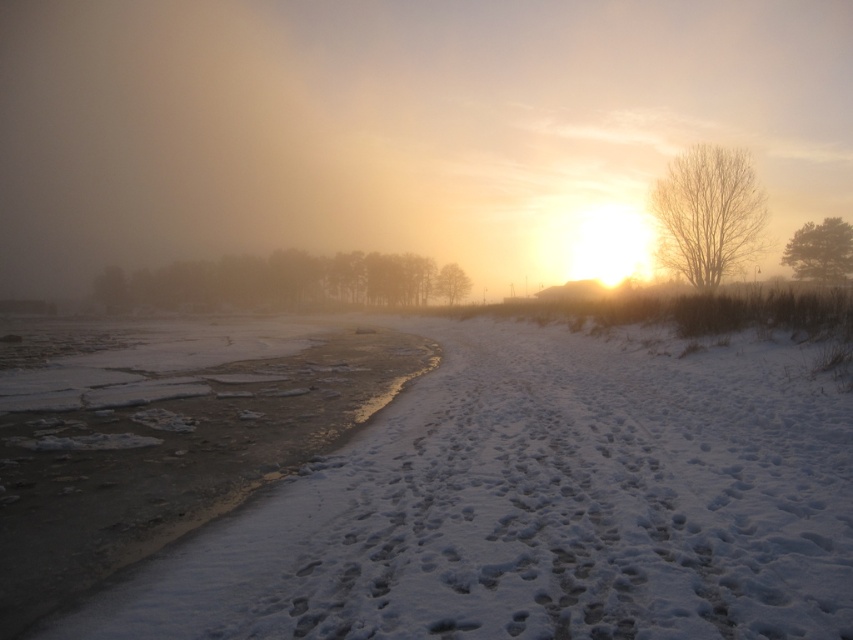
Question: Among these objects, which one is farthest from the camera?

Choices:
 (A) green textured tree at right
 (B) smooth brown tree at center

Answer: (B)

Question: Can you confirm if green matte trees at center is smaller than smooth brown tree at center?

Choices:
 (A) yes
 (B) no

Answer: (B)

Question: Which point is closer to the camera?

Choices:
 (A) (439, 294)
 (B) (785, 253)

Answer: (B)

Question: Which point appears closest to the camera in this image?

Choices:
 (A) (732, 266)
 (B) (811, 253)
 (C) (460, 280)

Answer: (A)

Question: Does bare branches at right appear over smooth brown tree at center?

Choices:
 (A) no
 (B) yes

Answer: (B)

Question: Does green matte trees at center have a greater width compared to bare branches at right?

Choices:
 (A) no
 (B) yes

Answer: (B)